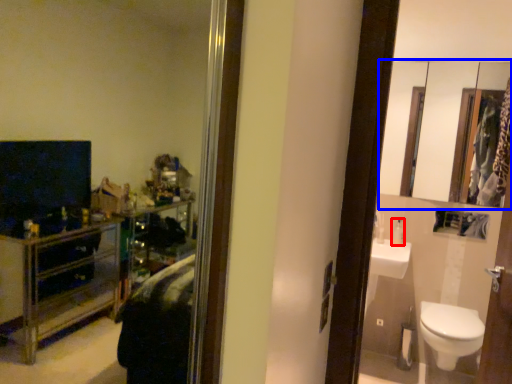
Question: Which object is further to the camera taking this photo, toiletry (highlighted by a red box) or mirror (highlighted by a blue box)?

Choices:
 (A) toiletry
 (B) mirror

Answer: (A)